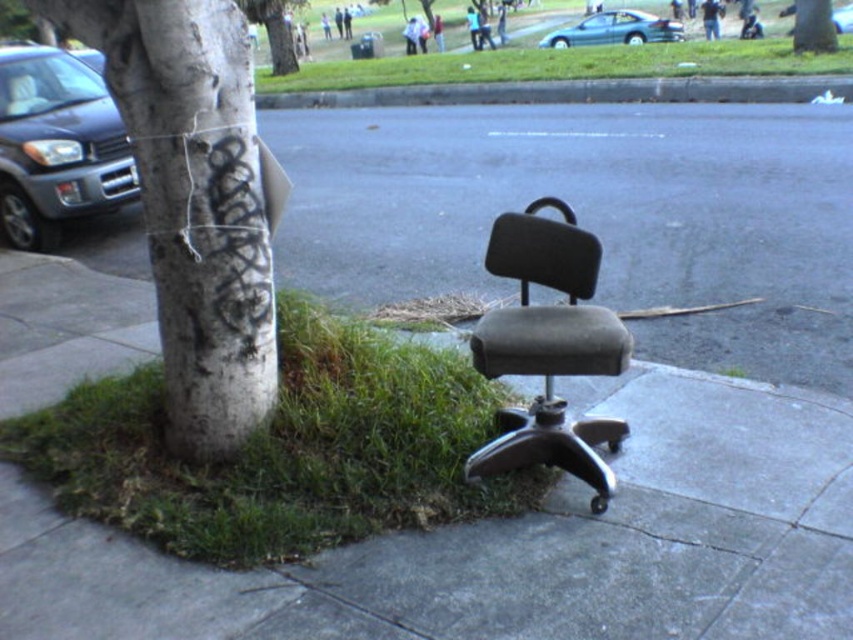
Is green grass at lower left smaller than white textured tree trunk at center-left?

No, green grass at lower left is not smaller than white textured tree trunk at center-left.

How distant is green grass at lower left from white textured tree trunk at center-left?

green grass at lower left and white textured tree trunk at center-left are 16.94 inches apart from each other.

Where is `green grass at lower left`? Image resolution: width=853 pixels, height=640 pixels. green grass at lower left is located at coordinates (283, 449).

Where is `green grass at lower left`? green grass at lower left is located at coordinates (283, 449).

Does gray asphalt curb at center appear over white textured tree trunk at upper center?

No, gray asphalt curb at center is not above white textured tree trunk at upper center.

Between point (726, 80) and point (271, 22), which one is positioned in front?

Point (726, 80) is in front.

Which is behind, point (770, 99) or point (282, 74)?

Point (282, 74)

This screenshot has width=853, height=640. What are the coordinates of `gray asphalt curb at center` in the screenshot? It's located at (575, 92).

Can you confirm if dark gray fabric swivel chair at center is taller than gray asphalt curb at center?

Yes.

Between dark gray fabric swivel chair at center and gray asphalt curb at center, which one is positioned higher?

gray asphalt curb at center

Is point (548, 230) positioned after point (706, 76)?

No, (548, 230) is closer to viewer.

Find the location of a particular element. This screenshot has width=853, height=640. dark gray fabric swivel chair at center is located at coordinates (548, 348).